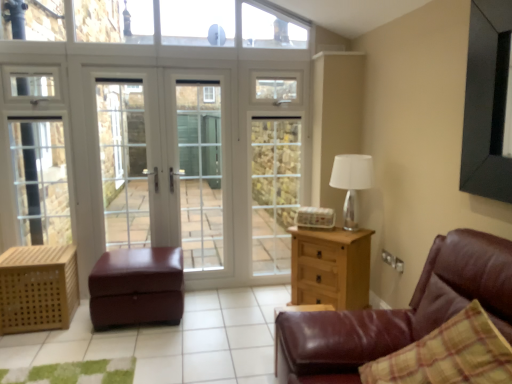
Find the location of a particular element. Image resolution: width=512 pixels, height=384 pixels. free location above white glass screen door at center, acting as the second screen door starting from the left (from a real-world perspective) is located at coordinates (194, 62).